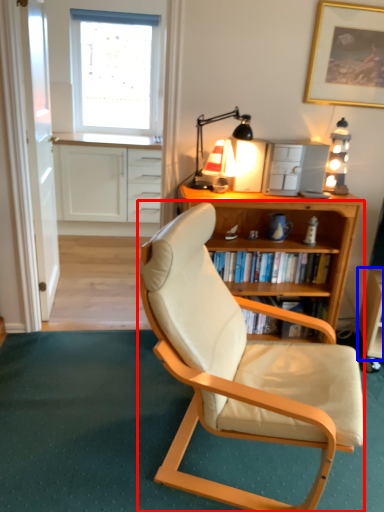
Question: Which object is further to the camera taking this photo, chair (highlighted by a red box) or table (highlighted by a blue box)?

Choices:
 (A) chair
 (B) table

Answer: (B)